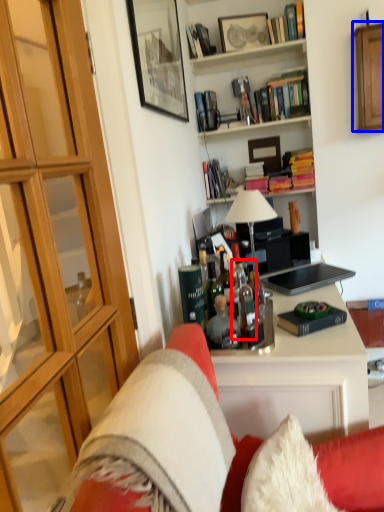
Question: Which object is closer to the camera taking this photo, bottle (highlighted by a red box) or cabinetry (highlighted by a blue box)?

Choices:
 (A) bottle
 (B) cabinetry

Answer: (A)